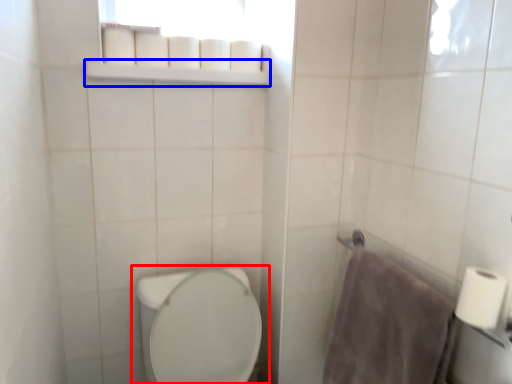
Question: Among these objects, which one is farthest to the camera, toilet (highlighted by a red box) or balustrade (highlighted by a blue box)?

Choices:
 (A) toilet
 (B) balustrade

Answer: (B)